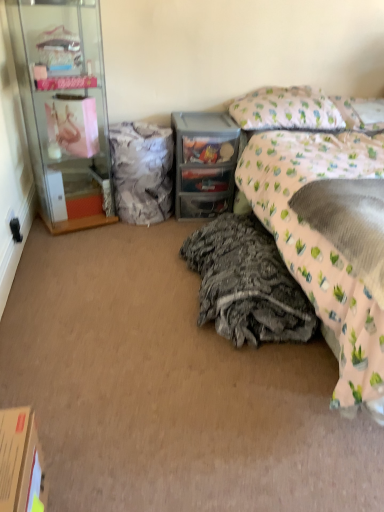
This screenshot has height=512, width=384. I want to click on free space between white textured fabric at center, which is the first material from back to front, and textured gray blanket at lower center, which is the second material in left-to-right order, so click(159, 259).